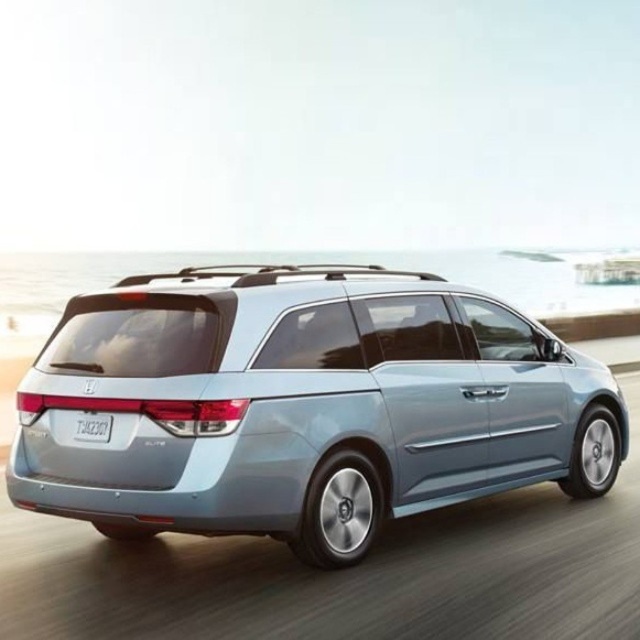
Question: From the image, what is the correct spatial relationship of satin metallic minivan at center in relation to white plastic license plate at center?

Choices:
 (A) right
 (B) left

Answer: (A)

Question: Which of the following is the farthest from the observer?

Choices:
 (A) white plastic license plate at center
 (B) satin metallic minivan at center

Answer: (A)

Question: Does satin metallic minivan at center appear over white plastic license plate at center?

Choices:
 (A) no
 (B) yes

Answer: (A)

Question: Which point is farther to the camera?

Choices:
 (A) satin metallic minivan at center
 (B) white plastic license plate at center

Answer: (B)

Question: Observing the image, what is the correct spatial positioning of satin metallic minivan at center in reference to white plastic license plate at center?

Choices:
 (A) above
 (B) below

Answer: (B)

Question: Among these points, which one is nearest to the camera?

Choices:
 (A) (243, 394)
 (B) (90, 419)

Answer: (A)